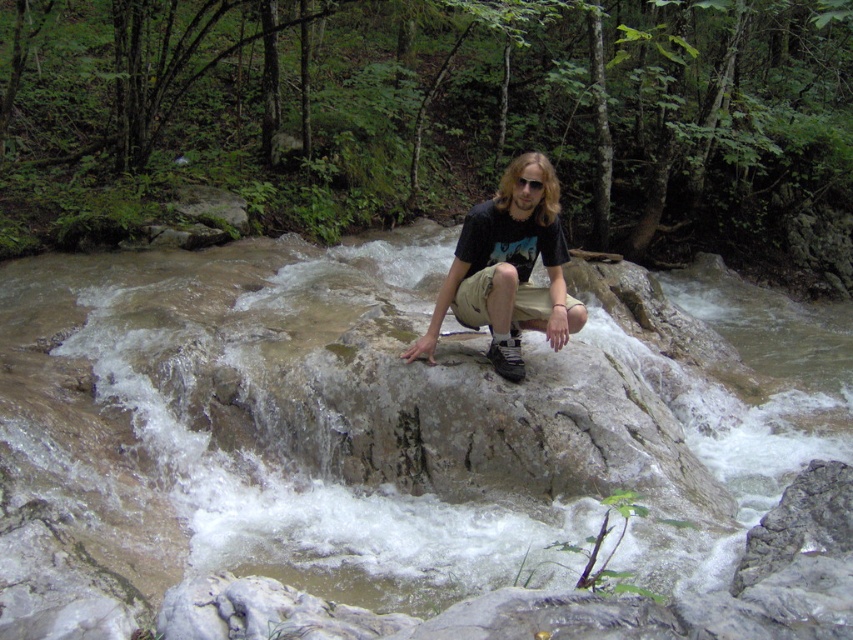
Consider the image. You are standing at the point labeled point (525, 301) and want to walk to the point labeled point (432, 371). Based on the scene description, will you have to go around any obstacles or can you walk directly towards your destination?

Since point (432, 371) is behind point (525, 301), you will not have to go around any obstacles and can walk directly towards your destination.